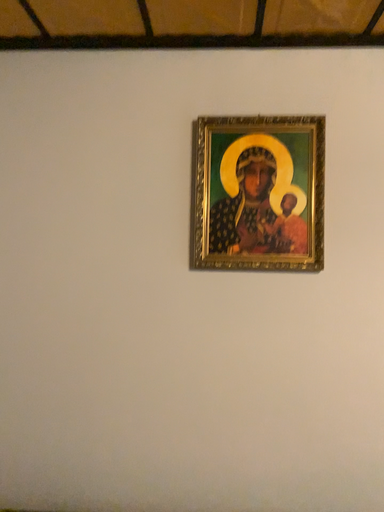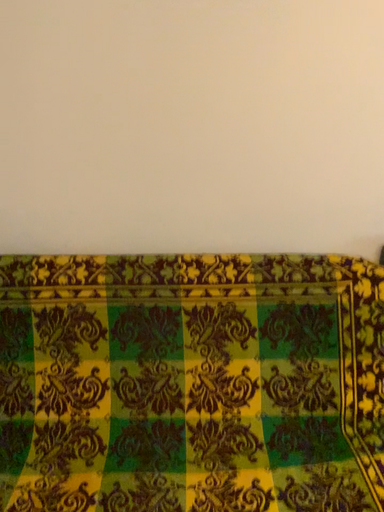
Question: How did the camera likely rotate when shooting the video?

Choices:
 (A) rotated downward
 (B) rotated upward

Answer: (A)